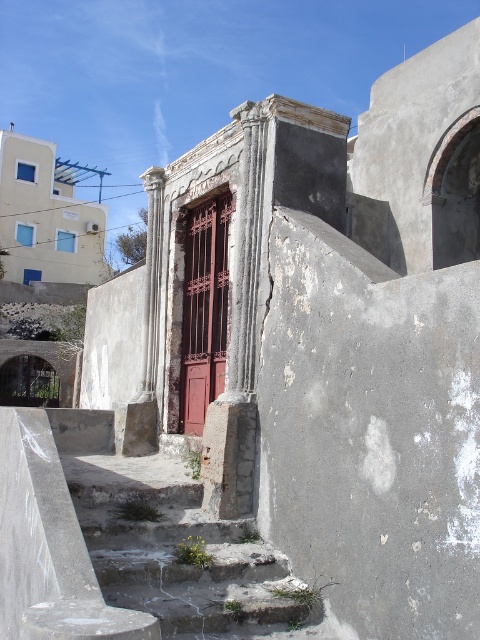
Which is above, rusty concrete stairs at lower center or rusty metal door at center?

rusty metal door at center

Does rusty concrete stairs at lower center lie in front of rusty metal door at center?

Yes, it is in front of rusty metal door at center.

Locate an element on the screen. This screenshot has height=640, width=480. rusty concrete stairs at lower center is located at coordinates (190, 564).